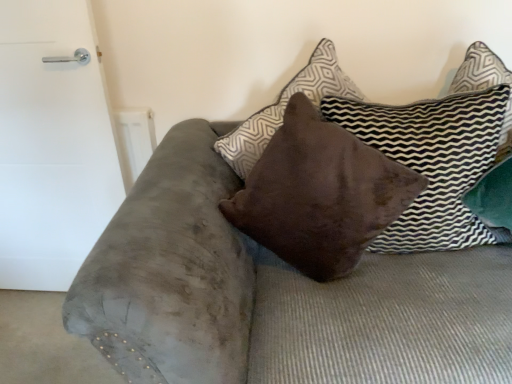
Question: Considering the relative sizes of brown suede pillow at center, positioned as the second pillow in right-to-left order, and brown velvet pillow at center, which is the 2th pillow from left to right, in the image provided, is brown suede pillow at center, positioned as the second pillow in right-to-left order, wider than brown velvet pillow at center, which is the 2th pillow from left to right,?

Choices:
 (A) yes
 (B) no

Answer: (A)

Question: Is brown suede pillow at center, positioned as the 1th pillow in left-to-right order, shorter than brown velvet pillow at center, which is the 2th pillow from left to right?

Choices:
 (A) no
 (B) yes

Answer: (A)

Question: From the image's perspective, is brown suede pillow at center, positioned as the 1th pillow in left-to-right order, located beneath brown velvet pillow at center, the 1th pillow in the right-to-left sequence?

Choices:
 (A) yes
 (B) no

Answer: (B)

Question: Can you confirm if brown suede pillow at center, positioned as the 1th pillow in left-to-right order, is smaller than brown velvet pillow at center, which is the 2th pillow from left to right?

Choices:
 (A) no
 (B) yes

Answer: (A)

Question: Is brown suede pillow at center, positioned as the second pillow in right-to-left order, thinner than brown velvet pillow at center, which is the 2th pillow from left to right?

Choices:
 (A) yes
 (B) no

Answer: (B)

Question: Is brown suede pillow at center, positioned as the second pillow in right-to-left order, to the left of brown velvet pillow at center, the 1th pillow in the right-to-left sequence, from the viewer's perspective?

Choices:
 (A) yes
 (B) no

Answer: (A)

Question: Is white matte door at left located within brown suede pillow at center, positioned as the second pillow in right-to-left order?

Choices:
 (A) yes
 (B) no

Answer: (B)

Question: Does brown suede pillow at center, positioned as the 1th pillow in left-to-right order, have a lesser width compared to white matte door at left?

Choices:
 (A) yes
 (B) no

Answer: (B)

Question: From a real-world perspective, is brown suede pillow at center, positioned as the second pillow in right-to-left order, on top of white matte door at left?

Choices:
 (A) yes
 (B) no

Answer: (A)

Question: Is brown suede pillow at center, positioned as the second pillow in right-to-left order, not close to white matte door at left?

Choices:
 (A) no
 (B) yes

Answer: (A)

Question: Is the depth of brown suede pillow at center, positioned as the 1th pillow in left-to-right order, greater than that of white matte door at left?

Choices:
 (A) yes
 (B) no

Answer: (B)

Question: From the image's perspective, is brown suede pillow at center, positioned as the 1th pillow in left-to-right order, above white matte door at left?

Choices:
 (A) yes
 (B) no

Answer: (A)

Question: Is brown velvet pillow at center, the 1th pillow in the right-to-left sequence, looking in the opposite direction of white matte door at left?

Choices:
 (A) no
 (B) yes

Answer: (A)